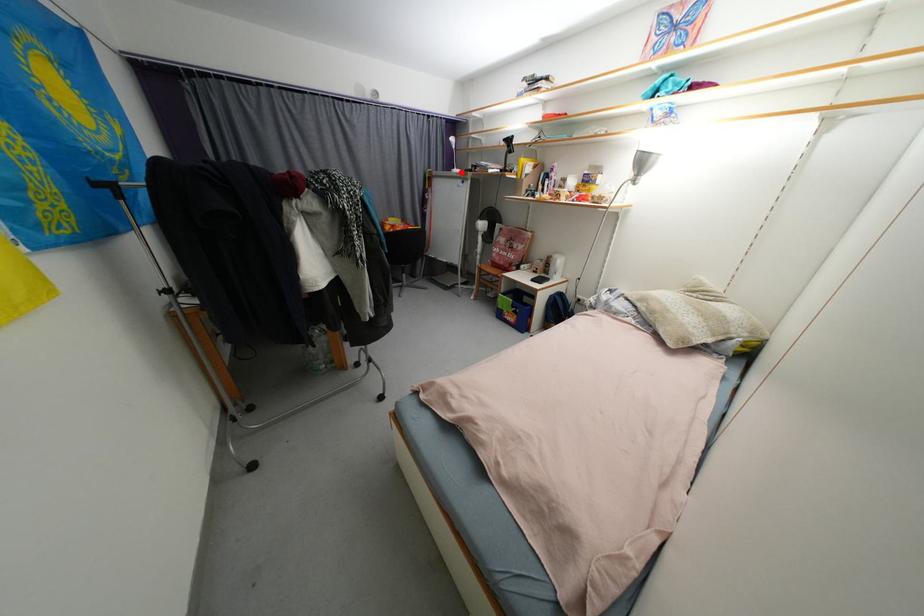
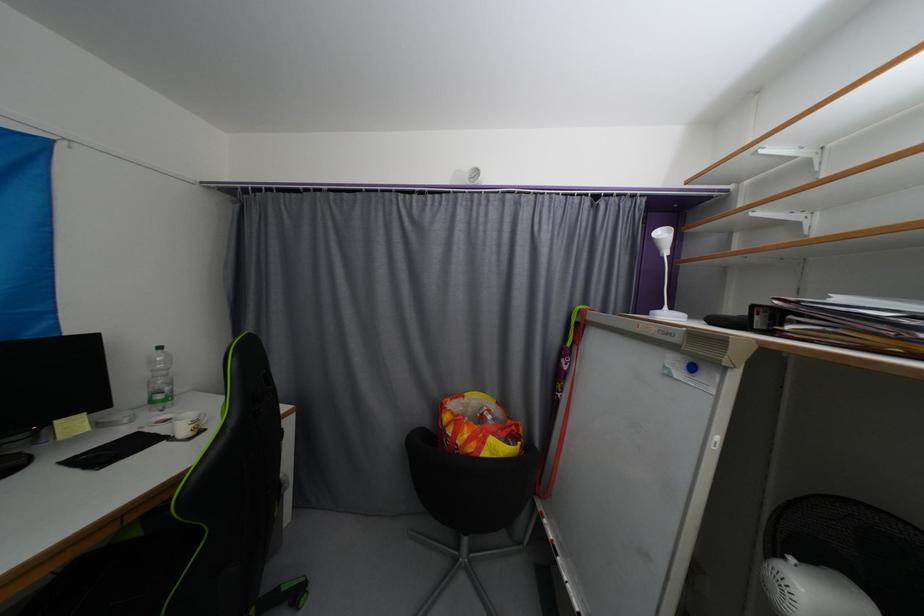
In the second image, find the point that corresponds to the highlighted location in the first image.

(672, 317)